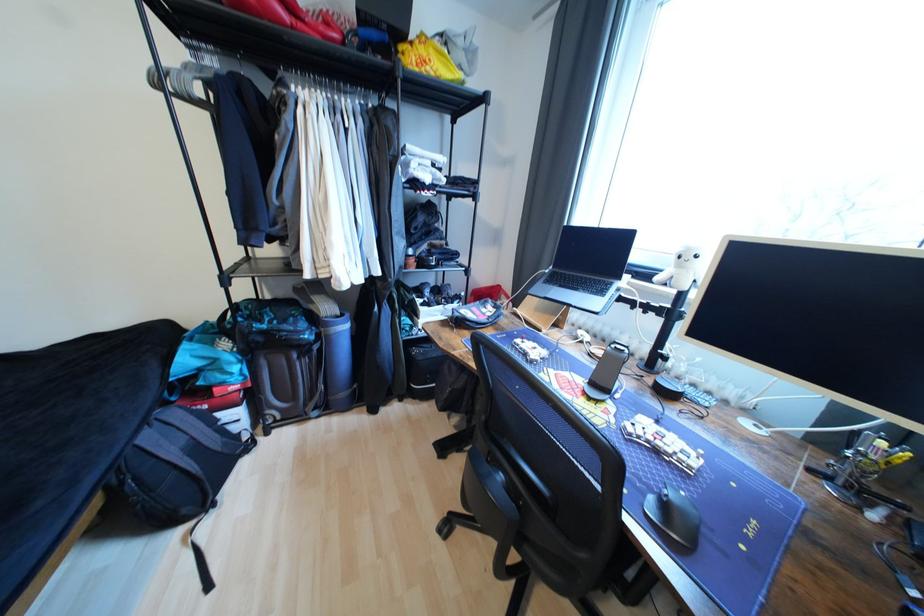
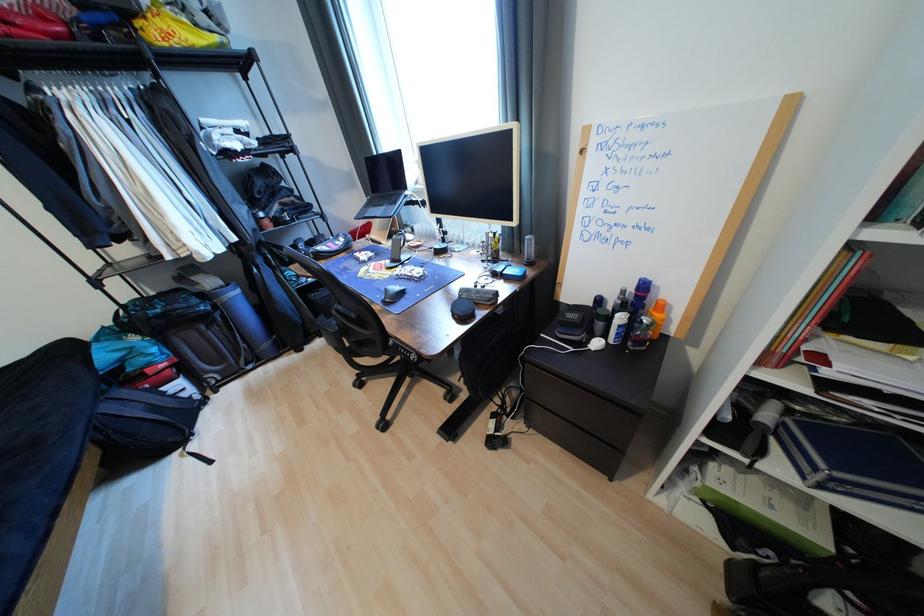
Question: The first image is from the beginning of the video and the second image is from the end. How did the camera likely rotate when shooting the video?

Choices:
 (A) Left
 (B) Right
 (C) Up
 (D) Down

Answer: (D)